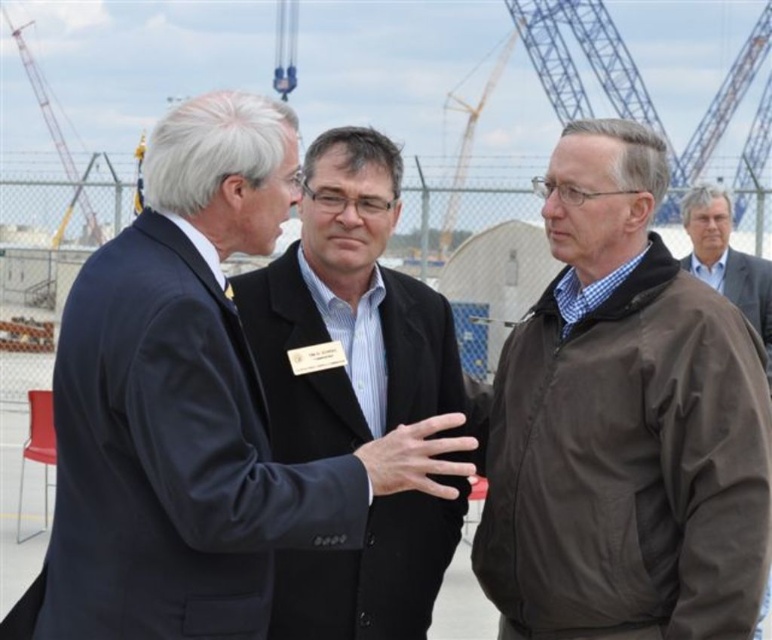
Who is taller, dark blue suit at center or brown leather jacket at right?

With more height is dark blue suit at center.

Is dark blue suit at center taller than brown leather jacket at right?

Yes.

Identify the location of dark blue suit at center. This screenshot has height=640, width=772. (171, 458).

Between point (608, 508) and point (310, 540), which one is positioned in front?

Point (310, 540) is more forward.

What do you see at coordinates (625, 424) in the screenshot?
I see `brown matte jacket at center` at bounding box center [625, 424].

Identify the location of brown matte jacket at center. This screenshot has width=772, height=640. (x=625, y=424).

Who is more distant from viewer, (225, 396) or (22, 60)?

Point (22, 60)

Who is higher up, dark blue suit at center or metallic gray crane at upper left?

metallic gray crane at upper left is above.

Is point (232, 465) farther from viewer compared to point (52, 131)?

No, (232, 465) is closer to viewer.

Image resolution: width=772 pixels, height=640 pixels. In order to click on dark blue suit at center in this screenshot , I will do `click(171, 458)`.